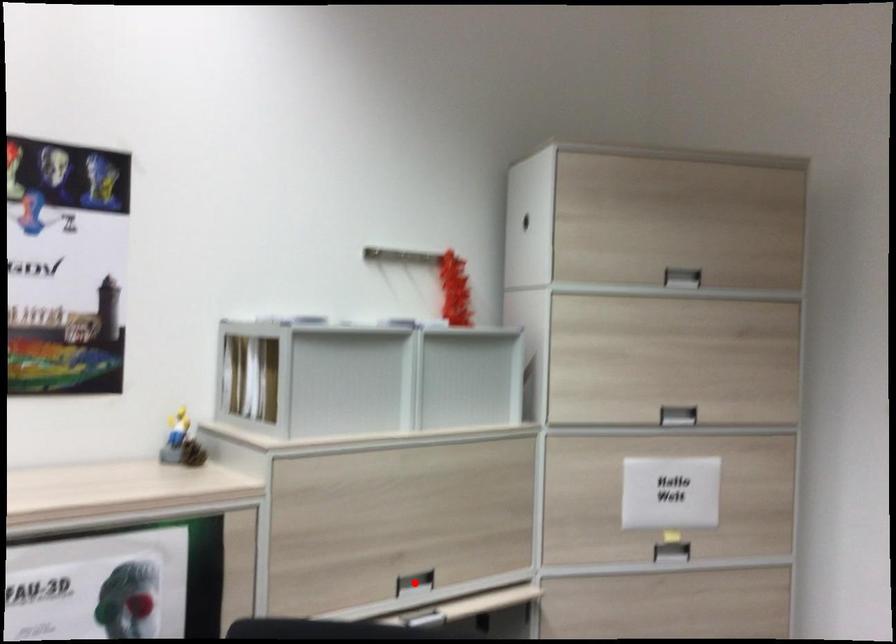
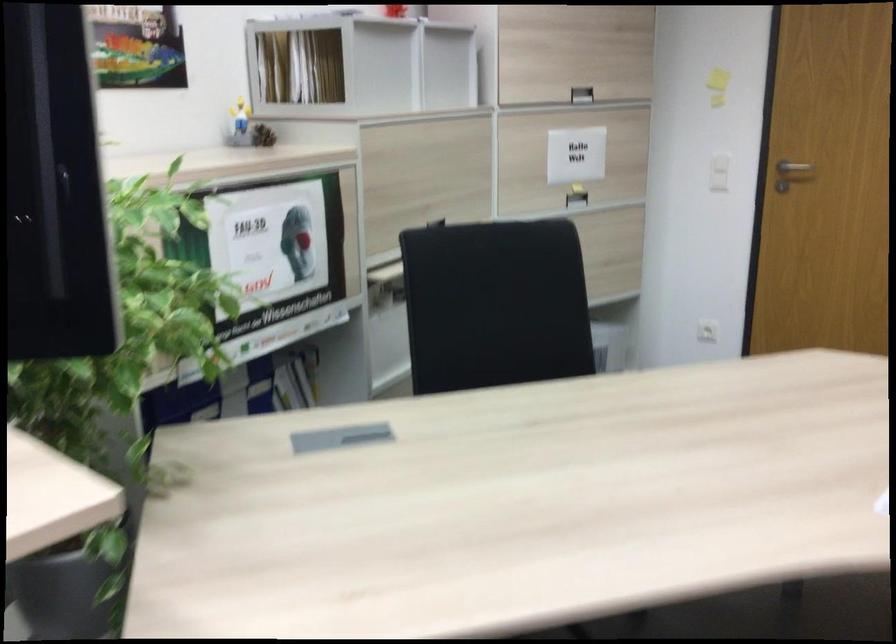
Question: I am providing you with two images of the same scene from different viewpoints. A red point is marked on the first image. Can you still see the location of the red point in image 2?

Choices:
 (A) Yes
 (B) No

Answer: (B)